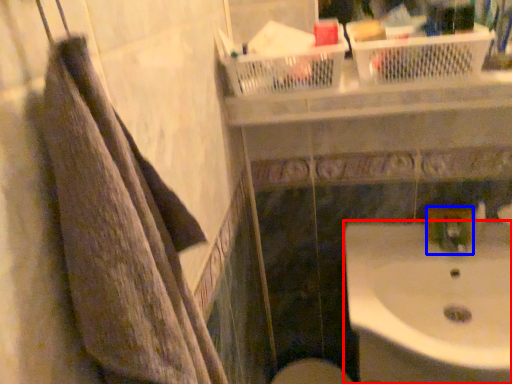
Question: Among these objects, which one is farthest to the camera, sink (highlighted by a red box) or plumbing fixture (highlighted by a blue box)?

Choices:
 (A) sink
 (B) plumbing fixture

Answer: (B)